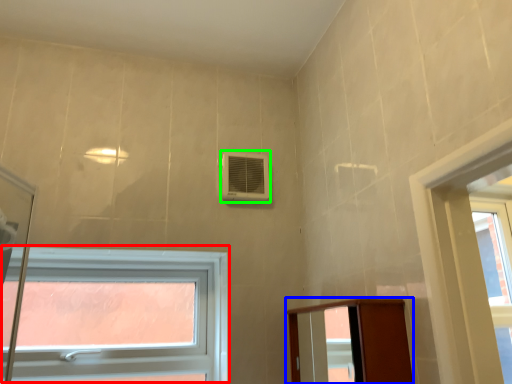
Question: Based on their relative distances, which object is nearer to window (highlighted by a red box)? Choose from elevator (highlighted by a blue box) and air conditioning (highlighted by a green box).

Choices:
 (A) elevator
 (B) air conditioning

Answer: (B)